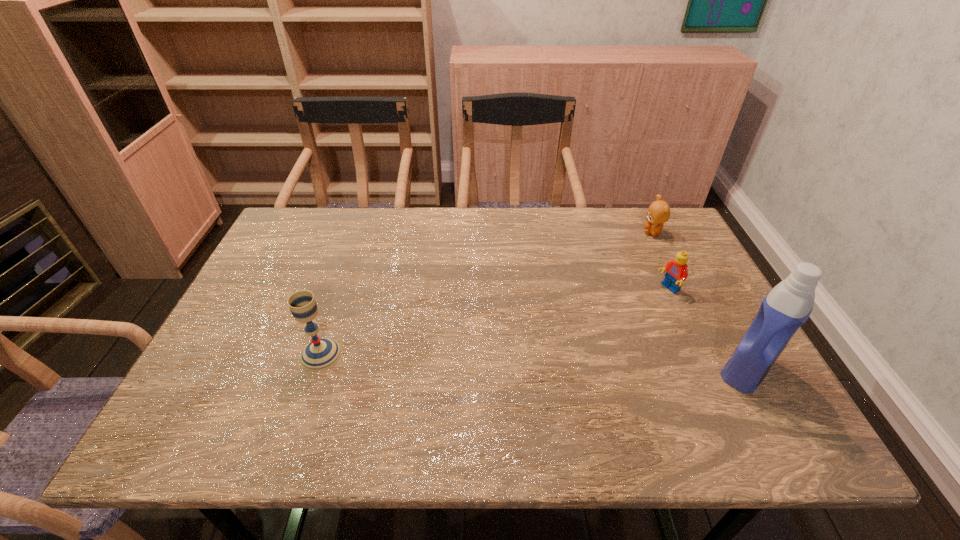
Where is `free space on the desktop that is between the leftmost object and the detergent and is positioned on the face of the Lego`? The width and height of the screenshot is (960, 540). free space on the desktop that is between the leftmost object and the detergent and is positioned on the face of the Lego is located at coordinates (521, 361).

The height and width of the screenshot is (540, 960). I want to click on vacant spot on the desktop that is between the leftmost object and the detergent and is positioned on the face of the farthest object, so pyautogui.click(x=549, y=362).